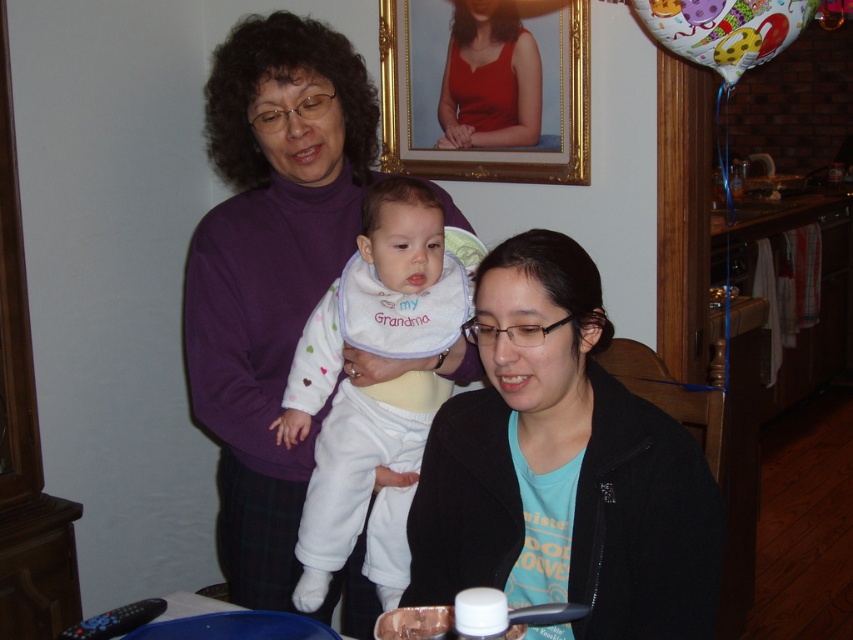
Question: Can you confirm if white fleece bib at center is positioned to the left of gold-framed portrait at upper center?

Choices:
 (A) no
 (B) yes

Answer: (B)

Question: Does black matte jacket at center come behind white fleece bib at center?

Choices:
 (A) no
 (B) yes

Answer: (A)

Question: Among these objects, which one is farthest from the camera?

Choices:
 (A) white fleece bib at center
 (B) black matte jacket at center

Answer: (A)

Question: Which object is positioned closest to the black matte jacket at center?

Choices:
 (A) white fleece bib at center
 (B) gold-framed portrait at upper center

Answer: (A)

Question: Which point appears closest to the camera in this image?

Choices:
 (A) (355, 417)
 (B) (486, 99)

Answer: (A)

Question: Is black matte jacket at center wider than white fleece bib at center?

Choices:
 (A) yes
 (B) no

Answer: (A)